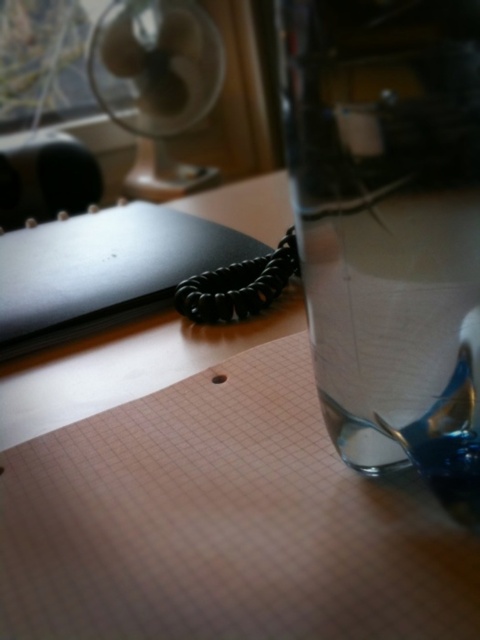
You are organizing your desk and need to place a 24.63 inch wide decorative item between the transparent glass jar at right and the matte black notepad at upper left. Will the item fit exactly between them?

The transparent glass jar at right is 24.63 inches from the matte black notepad at upper left, so a 24.63 inch wide decorative item would fit exactly between them.

You are organizing your desk and want to place a small plant between the transparent glass jar at right and the matte black notepad at upper left. Given their sizes, which object should the plant be closer to?

The transparent glass jar at right has a lesser width compared to the matte black notepad at upper left, so the plant should be placed closer to the transparent glass jar at right to balance the space.